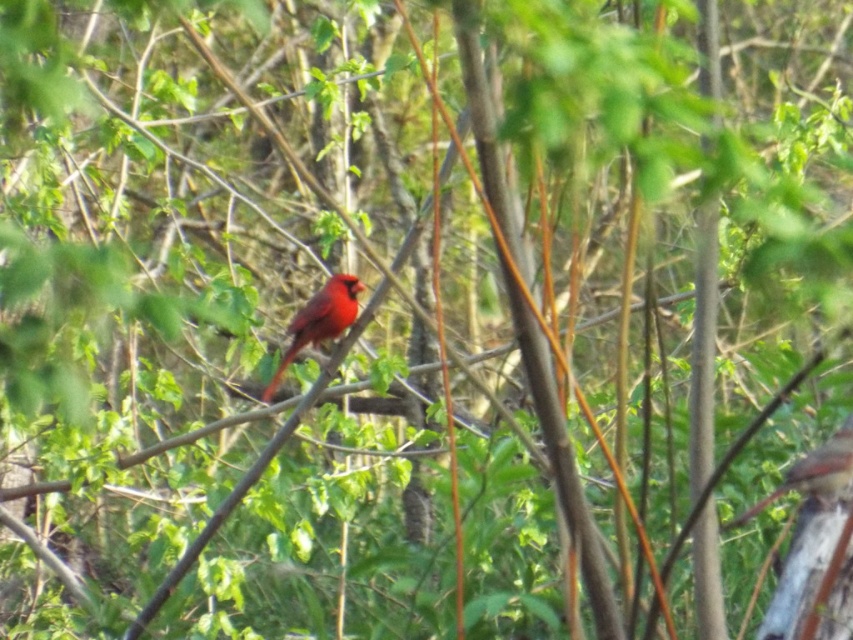
You are a photographer trying to capture the matte red cardinal at center and the matte red bird at center in a single shot. Since both are red, you want to ensure they are distinguishable in the photo. Which bird will appear closer to the camera lens?

The matte red cardinal at center will appear closer to the camera lens because it is in front of the matte red bird at center, which is positioned behind it.

You are a photographer trying to capture the red cardinal in the forest. You notice two points in the scene labeled as point 1 at coordinates point (292, 321) and point 2 at coordinates point (827, 465). Which point is closer to the camera?

Point 1 at coordinates point (292, 321) is closer to the camera because it is further to the viewer than point 2 at coordinates point (827, 465).